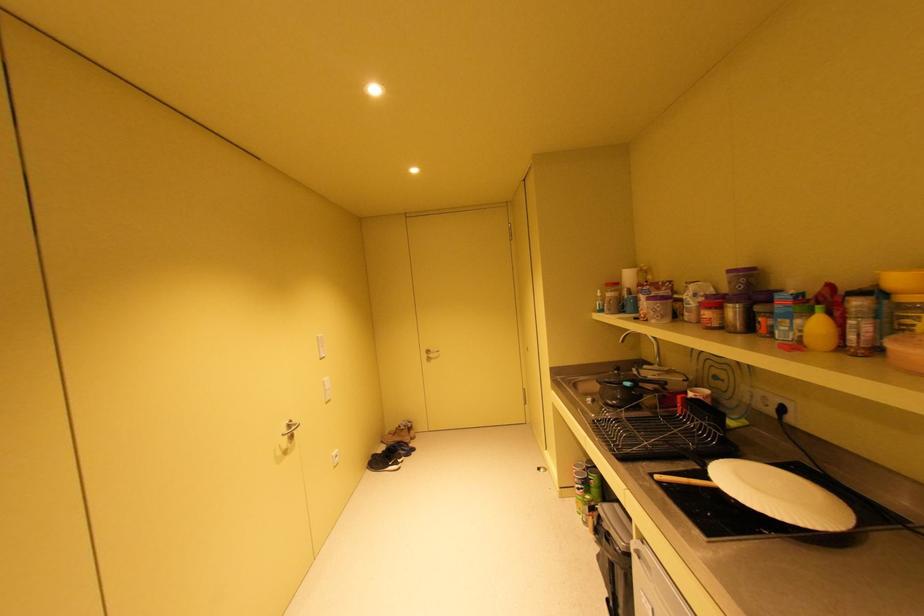
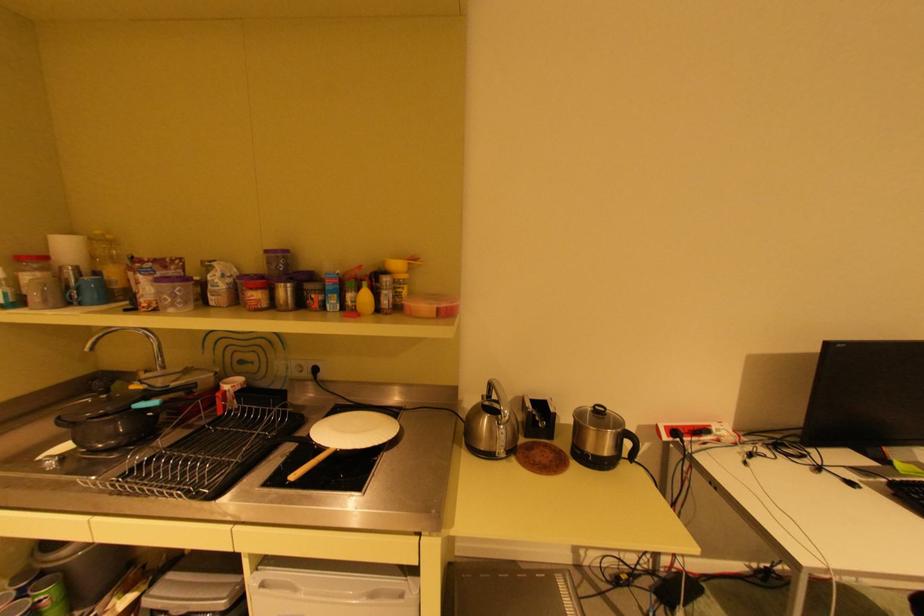
Find the pixel in the second image that matches point (630, 384) in the first image.

(139, 408)